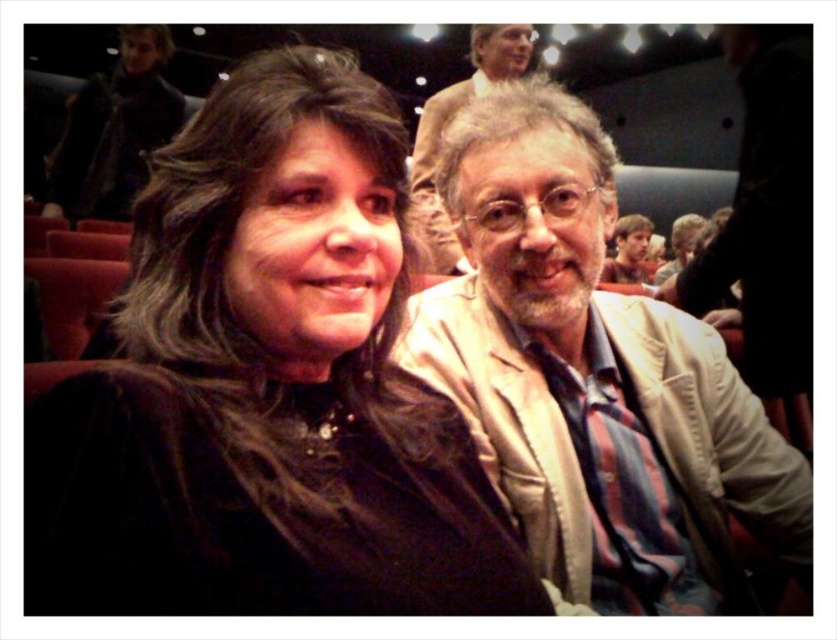
Question: Observing the image, what is the correct spatial positioning of black velvet jacket at center in reference to matte black jacket at center?

Choices:
 (A) left
 (B) right

Answer: (A)

Question: Which of the following is the closest to the observer?

Choices:
 (A) light beige jacket at center
 (B) smooth brown hair at upper right

Answer: (A)

Question: Can you confirm if light beige jacket at center is thinner than matte black jacket at center?

Choices:
 (A) no
 (B) yes

Answer: (A)

Question: Which point appears closest to the camera in this image?

Choices:
 (A) (285, 333)
 (B) (496, 65)
 (C) (563, 476)

Answer: (A)

Question: Does black velvet jacket at center have a smaller size compared to smooth brown hair at upper right?

Choices:
 (A) no
 (B) yes

Answer: (B)

Question: Which point is farther from the camera taking this photo?

Choices:
 (A) (634, 221)
 (B) (429, 516)
 (C) (440, 163)

Answer: (A)